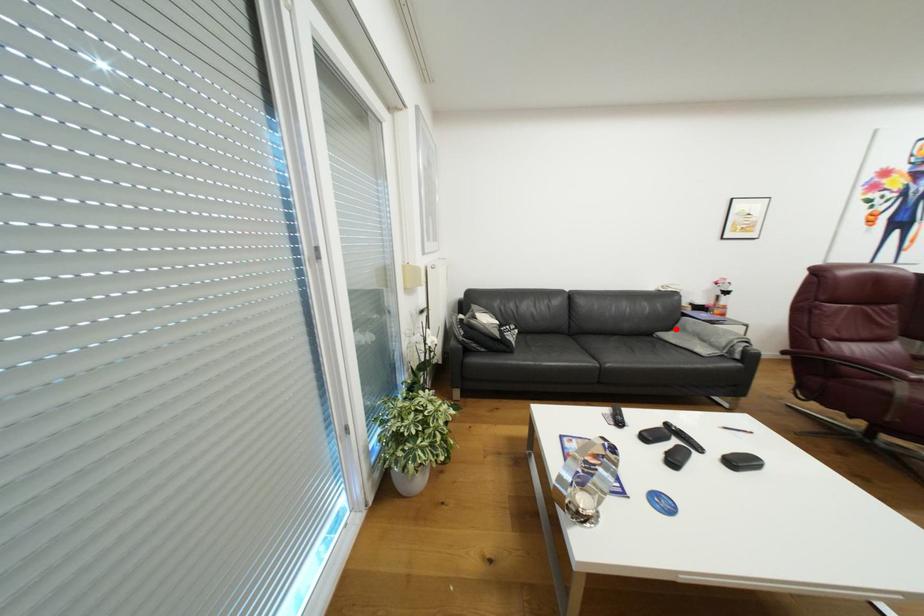
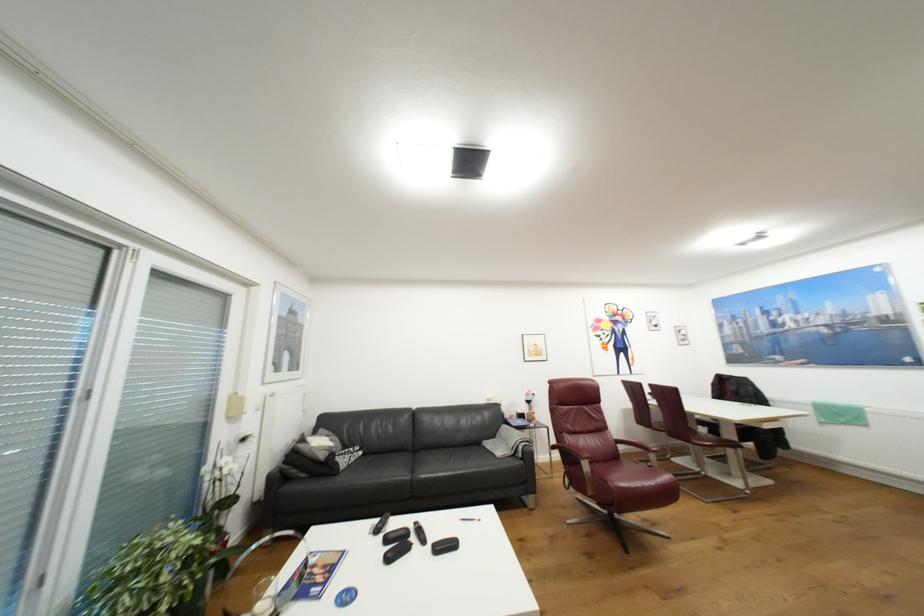
Question: A red point is marked in image1. In image2, is the corresponding 3D point closer to the camera or farther? Reply with the corresponding letter.

Choices:
 (A) The corresponding 3D point is closer.
 (B) The corresponding 3D point is farther.

Answer: (B)